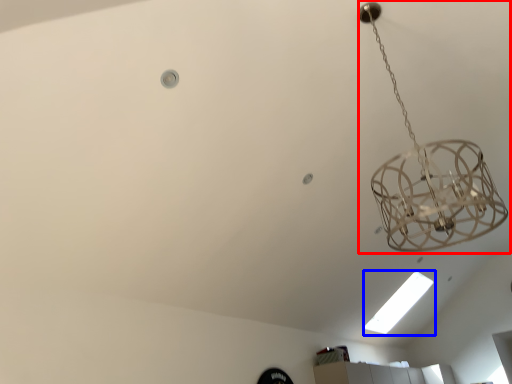
Question: Which point is closer to the camera, lamp (highlighted by a red box) or light bulb (highlighted by a blue box)?

Choices:
 (A) lamp
 (B) light bulb

Answer: (A)